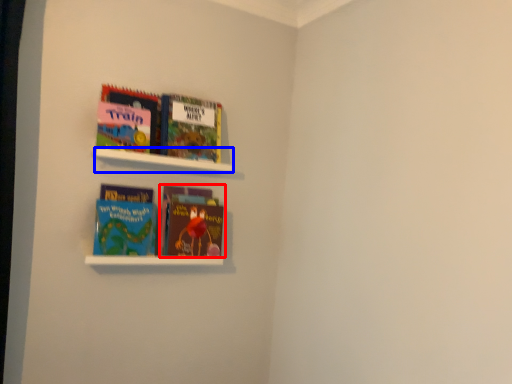
Question: Which object appears closest to the camera in this image, book (highlighted by a red box) or cabinet (highlighted by a blue box)?

Choices:
 (A) book
 (B) cabinet

Answer: (B)